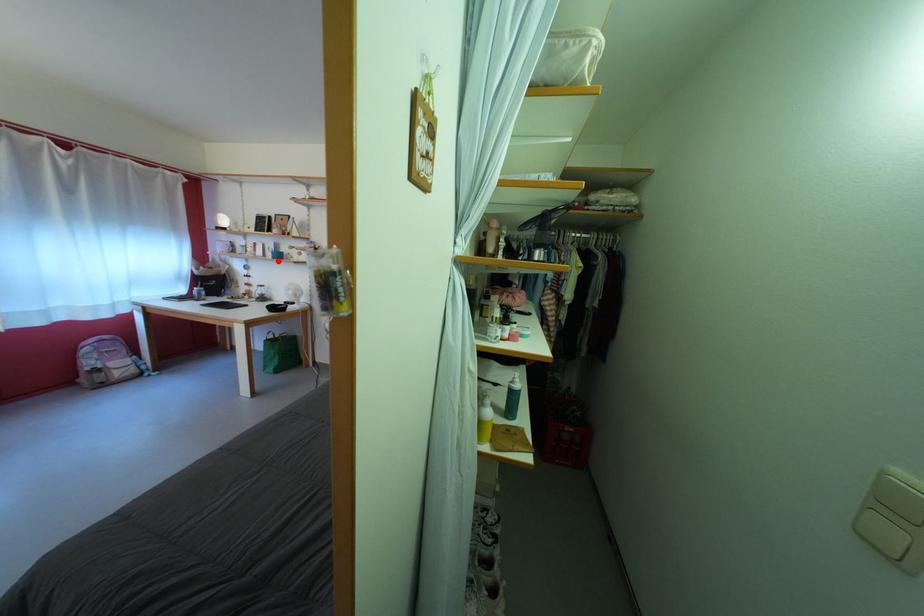
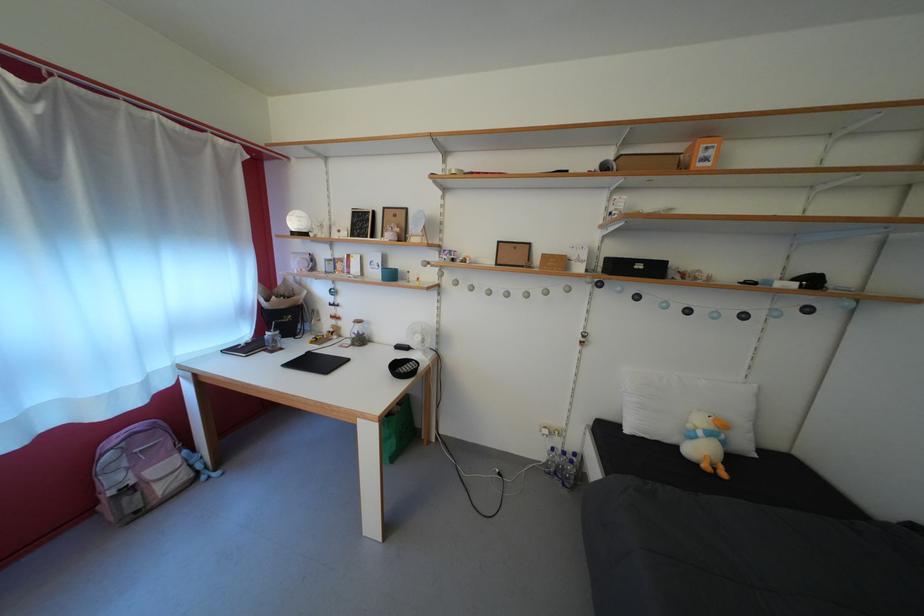
Find the pixel in the second image that matches the highlighted location in the first image.

(383, 280)